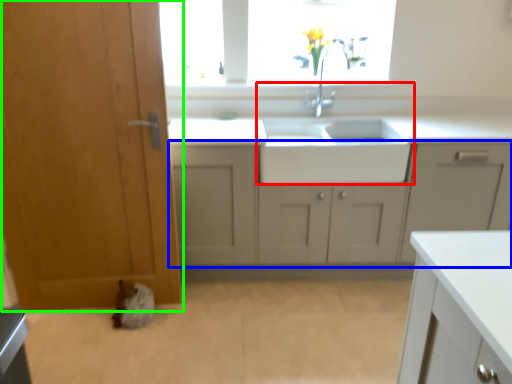
Question: Considering the real-world distances, which object is closest to sink (highlighted by a red box)? cabinetry (highlighted by a blue box) or door (highlighted by a green box).

Choices:
 (A) cabinetry
 (B) door

Answer: (A)